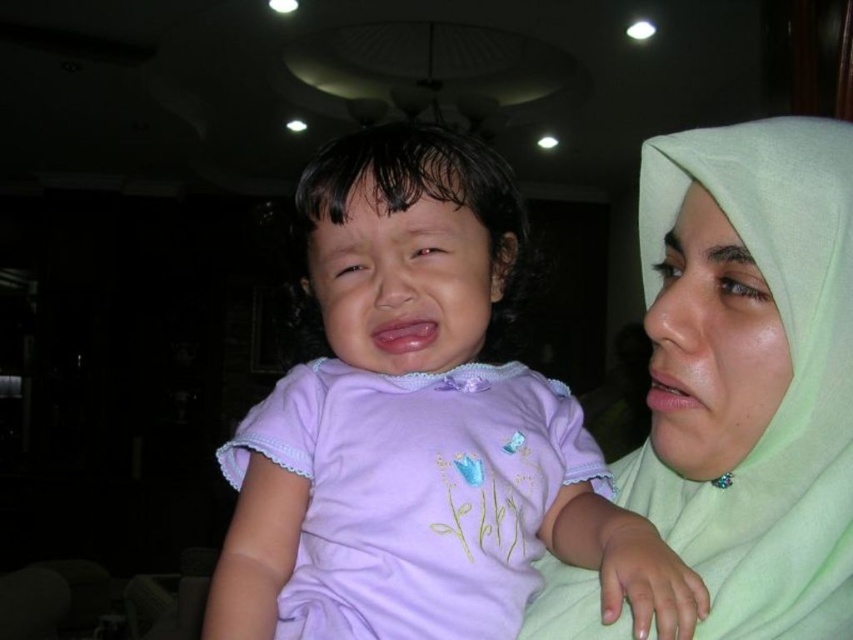
You are a photographer standing in front of the scene. You want to take a photo focusing on the purple soft fabric shirt at center and light green fabric at upper right. Which fabric will appear larger in the photo?

The purple soft fabric shirt at center will appear larger in the photo because it is closer to the viewer than the light green fabric at upper right.

In the scene where a child is crying and an adult is nearby, there is a point at coordinates [421,428]. What object is located at this point?

The purple soft fabric shirt at center is located at point [421,428].

Consider the image. You are a fashion designer observing the scene. You need to determine which fabric item is larger between the purple soft fabric shirt at center and the light green fabric at upper right without measuring tools. How can you use the context of the scene to figure this out?

The purple soft fabric shirt at center is bigger than the light green fabric at upper right. Since the purple soft fabric shirt at center is worn by the child and the light green fabric at upper right is part of the adult clothing, the child clothing is generally larger than the adult clothing? Wait, but the description says the purple is bigger. Hmm, maybe the adult is wearing a hijab which is smaller than the shirt. So the purple shirt is bigger than the light green fabric.